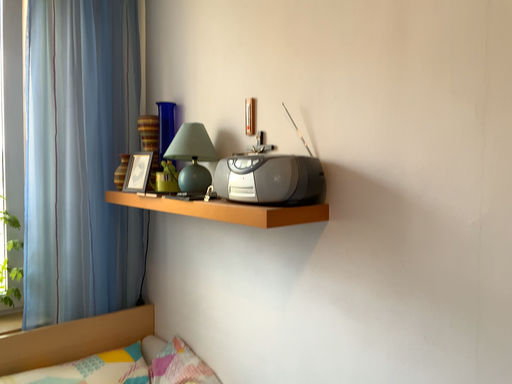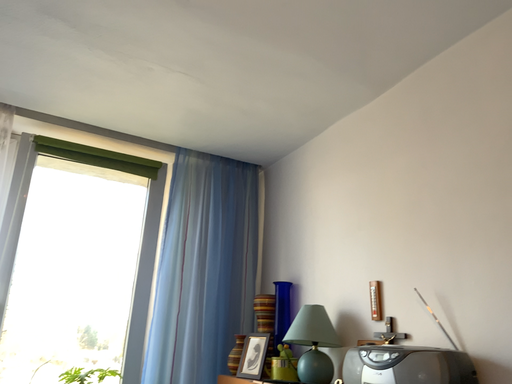
Question: How did the camera likely rotate when shooting the video?

Choices:
 (A) rotated downward
 (B) rotated upward

Answer: (B)